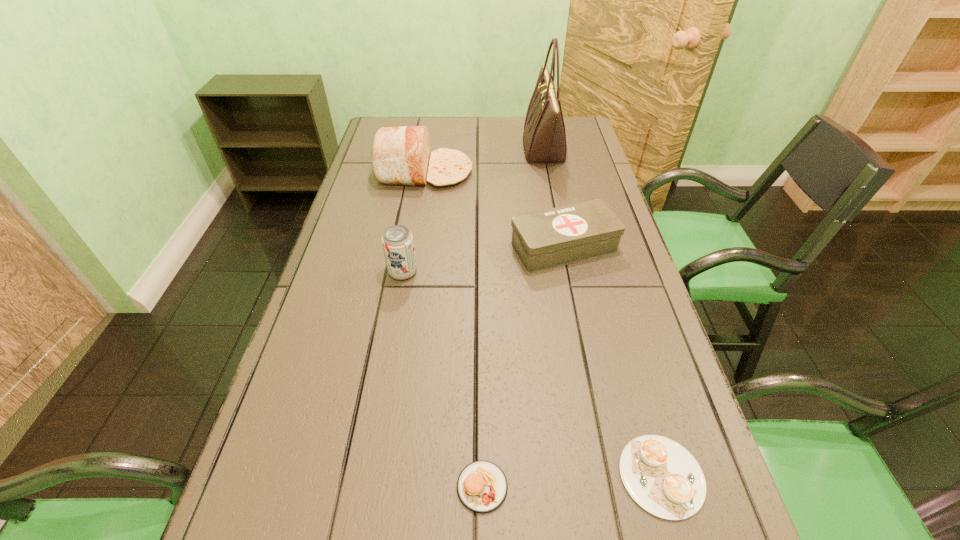
This screenshot has height=540, width=960. Identify the location of blank area in the image that satisfies the following two spatial constraints: 1. at the sliced end of the bread; 2. on the back side of the cappuccino. (374, 476).

This screenshot has height=540, width=960. I want to click on free space that satisfies the following two spatial constraints: 1. on the front-facing side of the tallest object; 2. on the front side of the patty, so click(x=613, y=487).